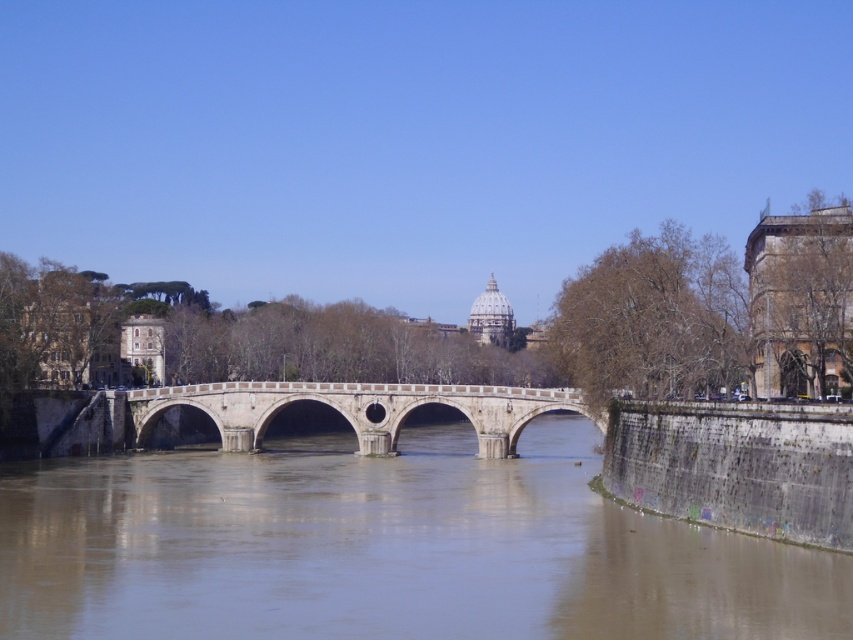
Looking at this image, you are a boat captain planning to navigate your vessel under the white stone arch bridge at center. Based on the scene, can your boat pass under the bridge without hitting the brown concrete river at center?

The brown concrete river at center is positioned under the white stone arch bridge at center, which means the bridge arches over the river. Therefore, your boat can safely pass under the white stone arch bridge at center as it is designed to allow passage over the brown concrete river at center.

You are standing at the origin point of the image. Which direction should you move to reach the brown concrete river at center?

You should move towards the center of the image to reach the brown concrete river at center, as it is located at point coordinates of (x=386, y=548).

You are standing at the base of the historic stone bridge and want to take a photo of the two points marked in the image. Which point, point (352, 513) or point (578, 410), is closer to you?

Point (352, 513) is closer to the camera than point (578, 410), so it is closer to you.